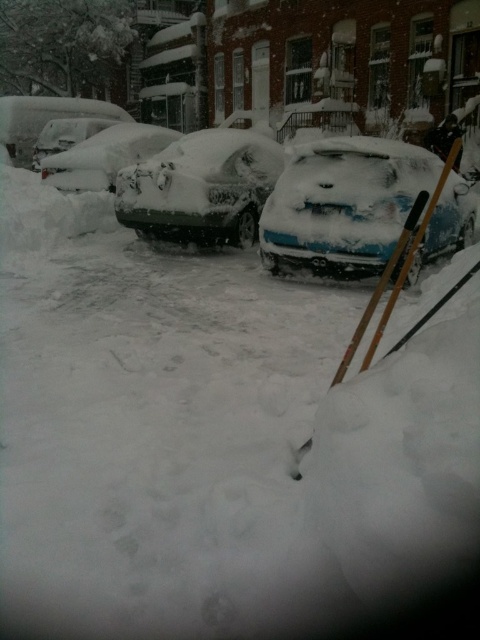
You are a delivery driver who needs to exit the parking spot. You see the blue matte car at center and the white matte car at left. Which car is blocking your way?

The blue matte car at center is blocking your way because it is in front of the white matte car at left, which would be your parking spot.

You are standing at the point marked as point (343, 205) in the snowy urban street scene. Which object are you currently standing on?

You are standing on the blue matte car at center because the point (343, 205) is on blue matte car at center.